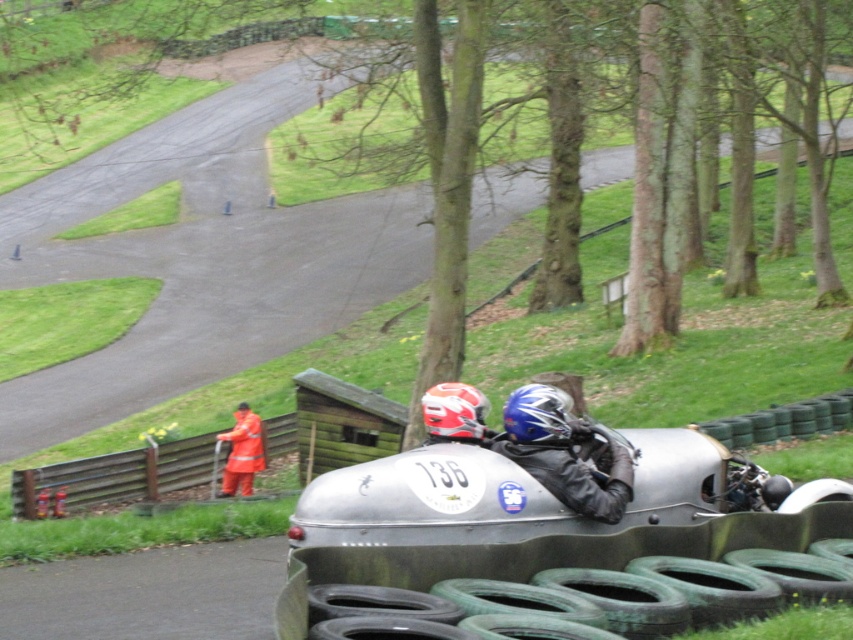
Question: Can you confirm if green rubber tires at lower center is positioned below green rubber tire at lower right?

Choices:
 (A) yes
 (B) no

Answer: (B)

Question: Based on their relative distances, which object is nearer to the black rubber tire at lower center?

Choices:
 (A) green rubber tires at lower center
 (B) orange reflective jacket at center

Answer: (A)

Question: Considering the real-world distances, which object is closest to the green rubber tire at lower right?

Choices:
 (A) blue matte helmet at center
 (B) green rubber tires at lower center
 (C) red matte helmet at center
 (D) black rubber tire at lower center

Answer: (B)

Question: Is green rubber tires at lower center closer to camera compared to red matte helmet at center?

Choices:
 (A) yes
 (B) no

Answer: (A)

Question: Is green rubber tire at lower right closer to the viewer compared to red matte helmet at center?

Choices:
 (A) no
 (B) yes

Answer: (B)

Question: Which of the following is the closest to the observer?

Choices:
 (A) black rubber tire at lower center
 (B) red matte helmet at center

Answer: (A)